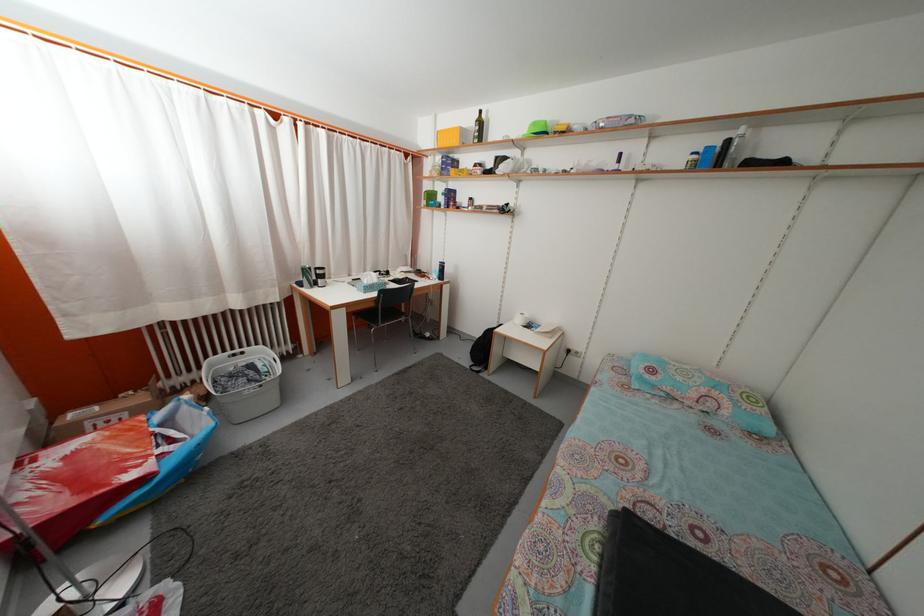
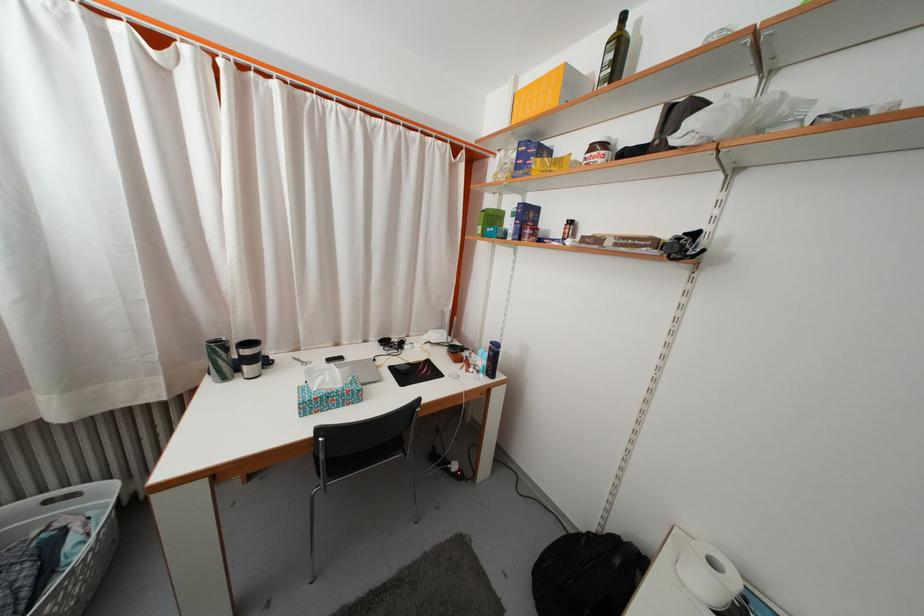
In the second image, find the point that corresponds to (396,286) in the first image.

(402, 369)